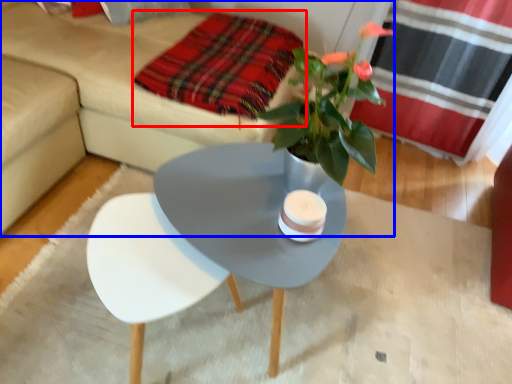
Question: Among these objects, which one is farthest to the camera, blanket (highlighted by a red box) or studio couch (highlighted by a blue box)?

Choices:
 (A) blanket
 (B) studio couch

Answer: (A)